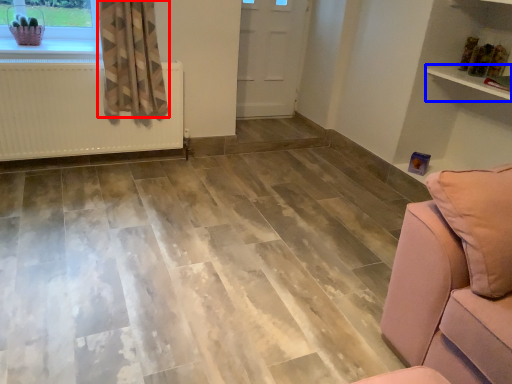
Question: Which object is further to the camera taking this photo, curtain (highlighted by a red box) or shelf (highlighted by a blue box)?

Choices:
 (A) curtain
 (B) shelf

Answer: (A)